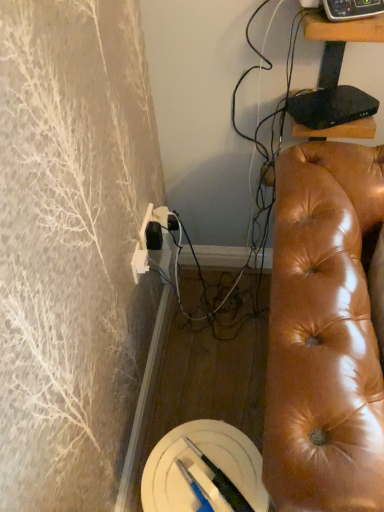
Find the location of a particular element. The width and height of the screenshot is (384, 512). black plastic remote control at upper right is located at coordinates (352, 9).

Image resolution: width=384 pixels, height=512 pixels. What do you see at coordinates (352, 9) in the screenshot?
I see `black plastic remote control at upper right` at bounding box center [352, 9].

Identify the location of shiny brown leather couch at right. (324, 334).

Is black glossy tv stand at upper right not close to shiny brown leather couch at right?

No, there isn't a large distance between black glossy tv stand at upper right and shiny brown leather couch at right.

From the image's perspective, which one is positioned higher, black glossy tv stand at upper right or shiny brown leather couch at right?

black glossy tv stand at upper right appears higher in the image.

Considering the positions of objects black glossy tv stand at upper right and shiny brown leather couch at right in the image provided, who is more to the right, black glossy tv stand at upper right or shiny brown leather couch at right?

shiny brown leather couch at right.

Can you confirm if black glossy tv stand at upper right is smaller than shiny brown leather couch at right?

Yes.

From a real-world perspective, does black glossy tv stand at upper right stand above black plastic remote control at upper right?

No, from a real-world perspective, black glossy tv stand at upper right is not above black plastic remote control at upper right.

There is a black glossy tv stand at upper right. In order to click on equipment above it (from a real-world perspective) in this screenshot , I will do `click(352, 9)`.

From the picture: Is black plastic remote control at upper right inside black glossy tv stand at upper right?

No.

Which of these two, black glossy tv stand at upper right or black plastic remote control at upper right, stands shorter?

Standing shorter between the two is black plastic remote control at upper right.

Does point (334, 191) come farther from viewer compared to point (331, 21)?

Yes.

Looking at this image, from the image's perspective, who appears lower, shiny brown leather couch at right or black plastic remote control at upper right?

From the image's view, shiny brown leather couch at right is below.

At what (x,y) coordinates should I click in order to perform the action: click on studio couch below the black plastic remote control at upper right (from the image's perspective). Please return your answer as a coordinate pair (x, y). This screenshot has width=384, height=512. Looking at the image, I should click on (324, 334).

Is shiny brown leather couch at right next to black plastic remote control at upper right and touching it?

shiny brown leather couch at right is not next to black plastic remote control at upper right, and they're not touching.

From the image's perspective, is black plastic remote control at upper right above black glossy tv stand at upper right?

Correct, black plastic remote control at upper right appears higher than black glossy tv stand at upper right in the image.

Is black plastic remote control at upper right positioned with its back to black glossy tv stand at upper right?

No, black plastic remote control at upper right is not facing the opposite direction of black glossy tv stand at upper right.

Where is `equipment on the left of black glossy tv stand at upper right`? This screenshot has width=384, height=512. equipment on the left of black glossy tv stand at upper right is located at coordinates (352, 9).

What's the angular difference between black plastic remote control at upper right and black glossy tv stand at upper right's facing directions?

black plastic remote control at upper right and black glossy tv stand at upper right are facing 25.6 degrees away from each other.

In the scene shown: Is black plastic remote control at upper right oriented towards shiny brown leather couch at right?

No, black plastic remote control at upper right is not turned towards shiny brown leather couch at right.

Which of these two, black plastic remote control at upper right or shiny brown leather couch at right, is smaller?

black plastic remote control at upper right is smaller.

Which is in front, black plastic remote control at upper right or shiny brown leather couch at right?

shiny brown leather couch at right is more forward.

Identify the location of studio couch below the black plastic remote control at upper right (from a real-world perspective). This screenshot has width=384, height=512. (324, 334).

Is shiny brown leather couch at right next to black glossy tv stand at upper right and touching it?

No, shiny brown leather couch at right is not touching black glossy tv stand at upper right.

Identify the location of studio couch on the right of the black glossy tv stand at upper right. coord(324,334).

Is shiny brown leather couch at right positioned behind black glossy tv stand at upper right?

No, the depth of shiny brown leather couch at right is less than that of black glossy tv stand at upper right.

Which point is more distant from viewer, [297,442] or [341,53]?

The point [341,53] is more distant.

The height and width of the screenshot is (512, 384). What are the coordinates of `furniture on the left of shiny brown leather couch at right` in the screenshot? It's located at (339, 41).

Where is `furniture below the black plastic remote control at upper right (from a real-world perspective)`? The width and height of the screenshot is (384, 512). furniture below the black plastic remote control at upper right (from a real-world perspective) is located at coordinates (339, 41).

When comparing their distances from black glossy tv stand at upper right, does shiny brown leather couch at right or black plastic remote control at upper right seem further?

shiny brown leather couch at right lies further to black glossy tv stand at upper right than the other object.

When comparing their distances from black plastic remote control at upper right, does black glossy tv stand at upper right or shiny brown leather couch at right seem closer?

black glossy tv stand at upper right.

Considering their positions, is black plastic remote control at upper right positioned closer to shiny brown leather couch at right than black glossy tv stand at upper right?

Based on the image, black glossy tv stand at upper right appears to be nearer to shiny brown leather couch at right.

When comparing their distances from shiny brown leather couch at right, does black glossy tv stand at upper right or black plastic remote control at upper right seem further?

black plastic remote control at upper right is further to shiny brown leather couch at right.

Estimate the real-world distances between objects in this image. Which object is further from black plastic remote control at upper right, shiny brown leather couch at right or black glossy tv stand at upper right?

shiny brown leather couch at right.

When comparing their distances from black glossy tv stand at upper right, does black plastic remote control at upper right or shiny brown leather couch at right seem further?

Based on the image, shiny brown leather couch at right appears to be further to black glossy tv stand at upper right.

Image resolution: width=384 pixels, height=512 pixels. In order to click on furniture between black plastic remote control at upper right and shiny brown leather couch at right vertically in this screenshot , I will do `click(339, 41)`.